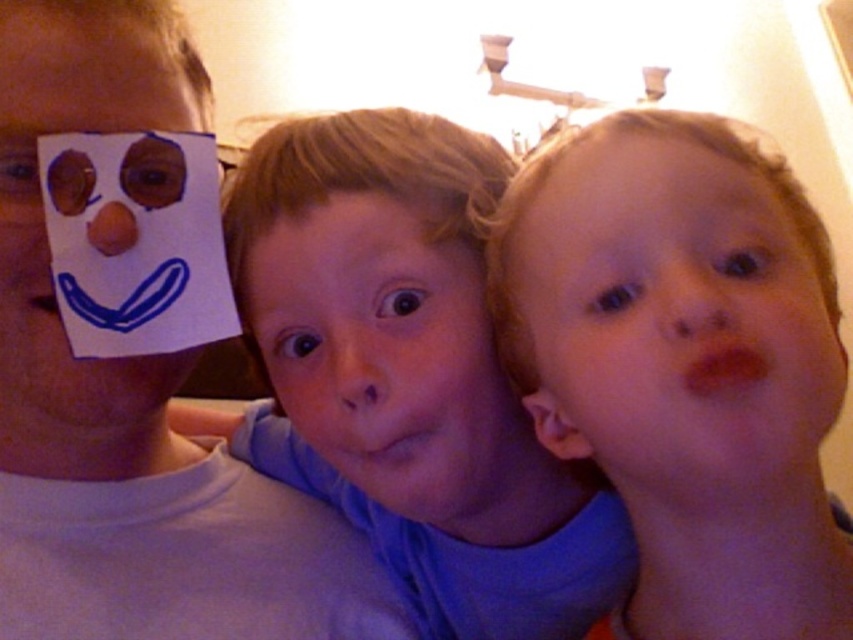
Question: Among these objects, which one is farthest from the camera?

Choices:
 (A) smooth skin face at center
 (B) white paper at left
 (C) smooth blue shirt at center

Answer: (B)

Question: Which point is closer to the camera taking this photo?

Choices:
 (A) (78, 64)
 (B) (169, 29)
 (C) (438, 321)

Answer: (C)

Question: Can you confirm if smooth skin face at center is positioned above matte paper face at left?

Choices:
 (A) yes
 (B) no

Answer: (B)

Question: Does white paper at left lie in front of smooth skin face at center?

Choices:
 (A) yes
 (B) no

Answer: (B)

Question: Is smooth blue shirt at center to the right of matte paper face at left from the viewer's perspective?

Choices:
 (A) no
 (B) yes

Answer: (B)

Question: Estimate the real-world distances between objects in this image. Which object is closer to the smooth skin face at center?

Choices:
 (A) smooth blue shirt at center
 (B) smooth skin face at right
 (C) white paper at left

Answer: (A)